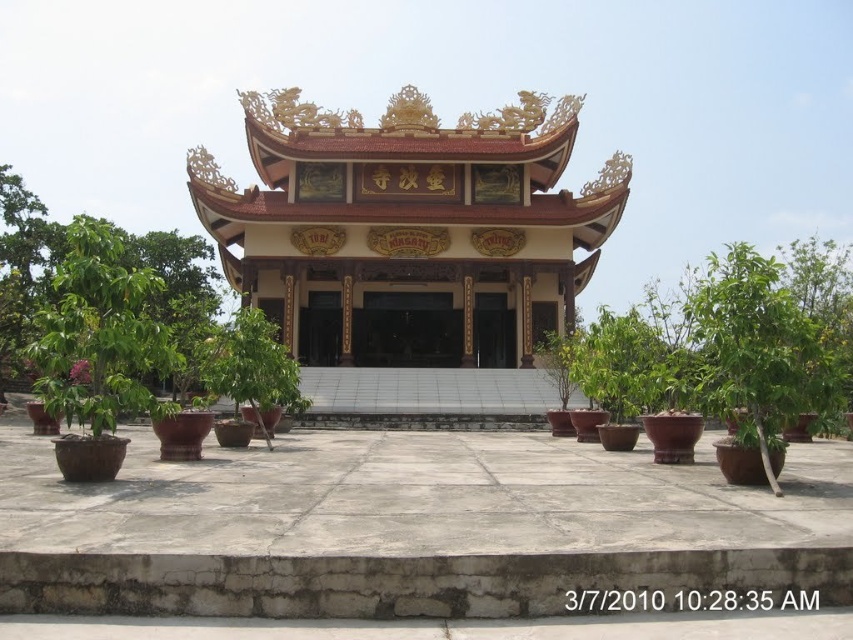
Question: Which point is closer to the camera taking this photo?

Choices:
 (A) (425, 189)
 (B) (125, 294)
 (C) (747, 352)

Answer: (C)

Question: Can you confirm if white glossy pagoda at center is bigger than green leafy tree at left?

Choices:
 (A) no
 (B) yes

Answer: (B)

Question: Which object appears farthest from the camera in this image?

Choices:
 (A) white glossy pagoda at center
 (B) green leafy tree at left
 (C) green glossy tree at center

Answer: (A)

Question: Is green glossy tree at center bigger than green leafy tree at left?

Choices:
 (A) no
 (B) yes

Answer: (A)

Question: Does white glossy pagoda at center appear under green glossy tree at center?

Choices:
 (A) no
 (B) yes

Answer: (A)

Question: Which point is closer to the camera?

Choices:
 (A) green leafy tree at left
 (B) white glossy pagoda at center
 (C) green glossy tree at center

Answer: (C)